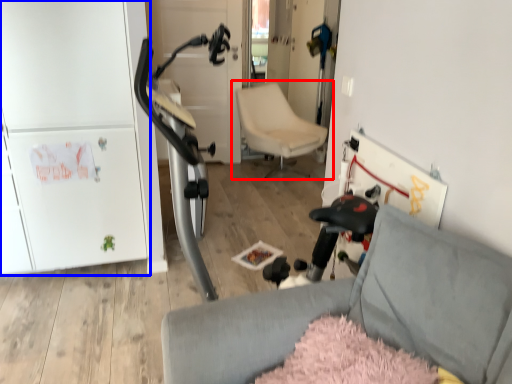
Question: Which object appears closest to the camera in this image, chair (highlighted by a red box) or fridge (highlighted by a blue box)?

Choices:
 (A) chair
 (B) fridge

Answer: (B)